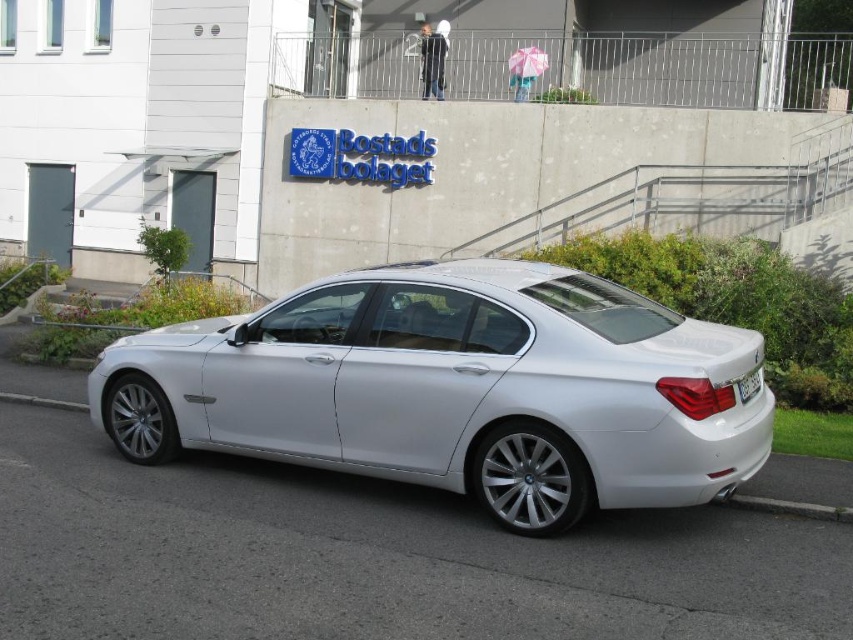
Who is lower down, gray concrete curb at lower right or white plastic license plate at rear?

Positioned lower is gray concrete curb at lower right.

Does gray concrete curb at lower right have a greater height compared to white plastic license plate at rear?

No.

Is point (809, 513) less distant than point (747, 378)?

No, (809, 513) is behind (747, 378).

Where is `gray concrete curb at lower right`? The width and height of the screenshot is (853, 640). gray concrete curb at lower right is located at coordinates [791, 508].

Does sleek silver sedan at center appear over white plastic license plate at rear?

Correct, sleek silver sedan at center is located above white plastic license plate at rear.

Is point (488, 262) positioned in front of point (755, 372)?

No, it is not.

Where is `sleek silver sedan at center`? This screenshot has width=853, height=640. sleek silver sedan at center is located at coordinates (456, 388).

Can you confirm if sleek silver sedan at center is shorter than gray concrete curb at lower right?

No, sleek silver sedan at center is not shorter than gray concrete curb at lower right.

Can you confirm if sleek silver sedan at center is wider than gray concrete curb at lower right?

Yes, sleek silver sedan at center is wider than gray concrete curb at lower right.

Is point (199, 381) more distant than point (833, 518)?

Yes, point (199, 381) is behind point (833, 518).

Locate an element on the screen. The height and width of the screenshot is (640, 853). sleek silver sedan at center is located at coordinates (456, 388).